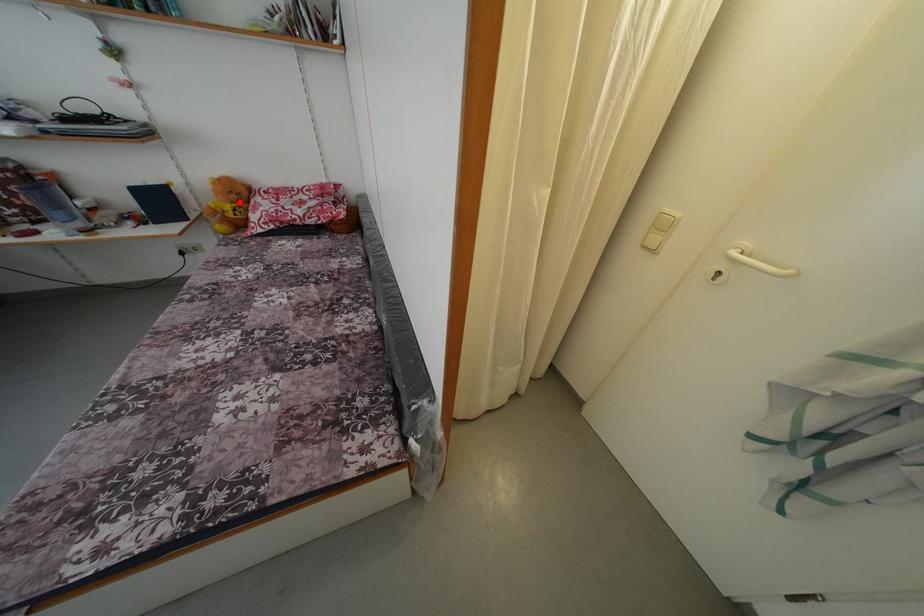
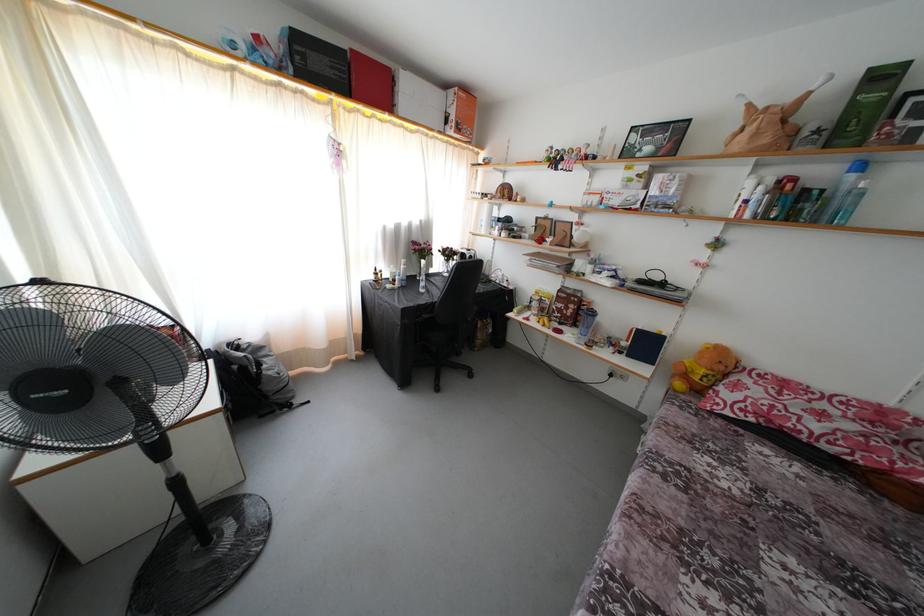
Where in the second image is the point corresponding to the highlighted location from the first image?

(726, 373)